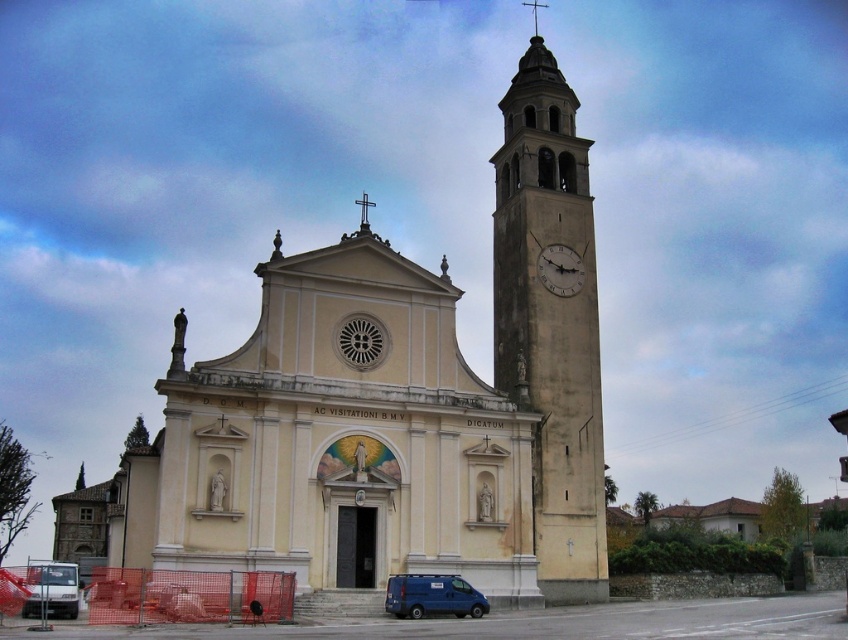
Based on the photo, you are a pedestrian standing at the front of the church, facing the entrance. You see the light beige stone clock tower at right and the white matte van at lower left. Which object is closer to you?

The light beige stone clock tower at right is closer to you because the white matte van at lower left is behind it.

You are a visitor arriving at the church and see the light beige stone clock tower at right and the white matte van at lower left. Which object is positioned more to the east if the van is facing north?

The light beige stone clock tower at right is positioned more to the east because it is to the right of the white matte van at lower left, which is facing north. Since the van faces north, its right side points east.

You are standing in front of the church and see the light beige stone clock tower at right and the blue matte van at lower center. Which object is positioned more to the east if the church faces north?

The light beige stone clock tower at right is positioned to the right of the blue matte van at lower center. Since the church faces north, the right side would correspond to the east direction. Therefore, the light beige stone clock tower at right is more to the east compared to the blue matte van at lower center.